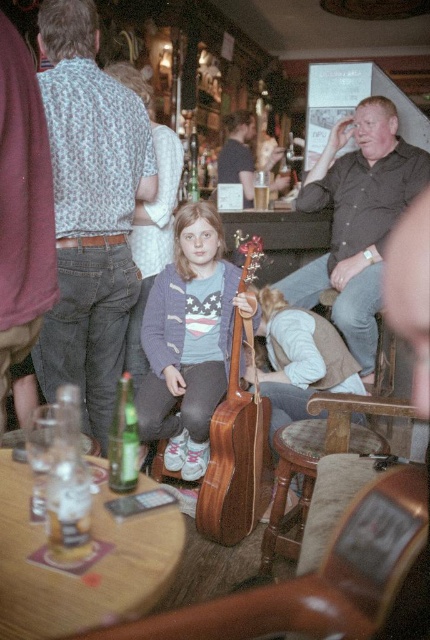
Between wooden textured stool at lower center and dark brown leather jacket at upper right, which one appears on the right side from the viewer's perspective?

Positioned to the right is wooden textured stool at lower center.

Who is more distant from viewer, (x=289, y=554) or (x=279, y=150)?

Positioned behind is point (x=279, y=150).

Identify the location of wooden textured stool at lower center. tap(288, 486).

Which is in front, point (100, 115) or point (159, 260)?

Point (100, 115)

Can you confirm if knitted fabric sweater at left is taller than knitted purple sweater at center?

Yes, knitted fabric sweater at left is taller than knitted purple sweater at center.

Which is in front, point (108, 244) or point (156, 170)?

Point (108, 244)

The width and height of the screenshot is (430, 640). What are the coordinates of `knitted fabric sweater at left` in the screenshot? It's located at (89, 211).

In the scene shown: Can you confirm if wooden acoustic guitar at center is positioned to the right of green glass bottle at table left?

Correct, you'll find wooden acoustic guitar at center to the right of green glass bottle at table left.

Is point (251, 275) more distant than point (110, 476)?

That is True.

The width and height of the screenshot is (430, 640). What are the coordinates of `wooden acoustic guitar at center` in the screenshot? It's located at (235, 452).